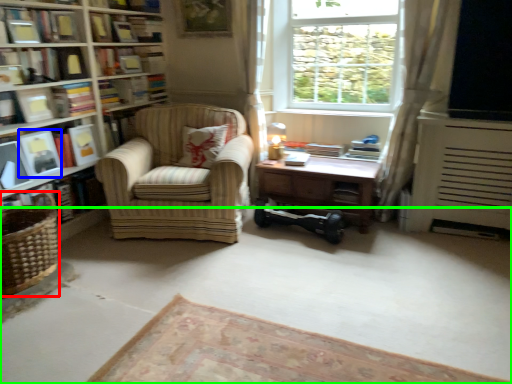
Question: Which object is the closest to the basket (highlighted by a red box)? Choose among these: paperback book (highlighted by a blue box) or plain (highlighted by a green box).

Choices:
 (A) paperback book
 (B) plain

Answer: (A)